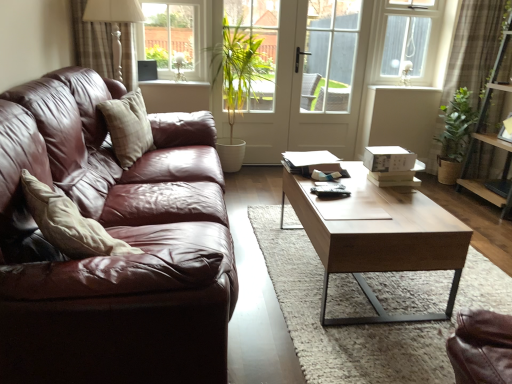
Question: Is the position of white glossy window sill at upper center, the first window sill in the right-to-left sequence, more distant than that of brown textured curtain at upper right, which is counted as the first curtain, starting from the right?

Choices:
 (A) no
 (B) yes

Answer: (B)

Question: Considering the relative sizes of white glossy window sill at upper center, which appears as the 2th window sill when viewed from the left, and brown textured curtain at upper right, which is counted as the first curtain, starting from the right, in the image provided, is white glossy window sill at upper center, which appears as the 2th window sill when viewed from the left, bigger than brown textured curtain at upper right, which is counted as the first curtain, starting from the right,?

Choices:
 (A) yes
 (B) no

Answer: (B)

Question: Considering the relative sizes of white glossy window sill at upper center, which appears as the 2th window sill when viewed from the left, and brown textured curtain at upper right, which is counted as the first curtain, starting from the right, in the image provided, is white glossy window sill at upper center, which appears as the 2th window sill when viewed from the left, thinner than brown textured curtain at upper right, which is counted as the first curtain, starting from the right,?

Choices:
 (A) no
 (B) yes

Answer: (B)

Question: Is brown textured curtain at upper right, arranged as the 2th curtain when viewed from the left, surrounded by white glossy window sill at upper center, which appears as the 1th window sill when viewed from the back?

Choices:
 (A) no
 (B) yes

Answer: (A)

Question: Can we say white glossy window sill at upper center, which appears as the 1th window sill when viewed from the back, lies outside brown textured curtain at upper right, arranged as the 2th curtain when viewed from the left?

Choices:
 (A) no
 (B) yes

Answer: (B)

Question: From their relative heights in the image, would you say white glass screen door at center is taller or shorter than white glossy window sill at upper center, acting as the second window sill starting from the front?

Choices:
 (A) short
 (B) tall

Answer: (B)

Question: In terms of width, does white glass screen door at center look wider or thinner when compared to white glossy window sill at upper center, the first window sill in the right-to-left sequence?

Choices:
 (A) thin
 (B) wide

Answer: (A)

Question: Based on their sizes in the image, would you say white glass screen door at center is bigger or smaller than white glossy window sill at upper center, acting as the second window sill starting from the front?

Choices:
 (A) small
 (B) big

Answer: (B)

Question: From the image's perspective, relative to white glossy window sill at upper center, the first window sill in the right-to-left sequence, is white glass screen door at center above or below?

Choices:
 (A) above
 (B) below

Answer: (A)

Question: Considering the relative positions of white glossy window sill at upper center, the 1th window sill positioned from the front, and leather couch at left in the image provided, is white glossy window sill at upper center, the 1th window sill positioned from the front, to the left or to the right of leather couch at left?

Choices:
 (A) left
 (B) right

Answer: (A)

Question: Looking at the image, does white glossy window sill at upper center, which is counted as the 1th window sill, starting from the left, seem bigger or smaller compared to leather couch at left?

Choices:
 (A) small
 (B) big

Answer: (A)

Question: From the image's perspective, is white glossy window sill at upper center, the 1th window sill positioned from the front, located above or below leather couch at left?

Choices:
 (A) above
 (B) below

Answer: (A)

Question: Considering their positions, is white glossy window sill at upper center, which ranks as the second window sill in right-to-left order, located in front of or behind leather couch at left?

Choices:
 (A) front
 (B) behind

Answer: (B)

Question: Considering the positions of brown textured curtain at upper right, which is counted as the first curtain, starting from the right, and clear glass window at upper left, marked as the second window in a right-to-left arrangement, in the image, is brown textured curtain at upper right, which is counted as the first curtain, starting from the right, wider or thinner than clear glass window at upper left, marked as the second window in a right-to-left arrangement,?

Choices:
 (A) thin
 (B) wide

Answer: (B)

Question: Considering their positions, is brown textured curtain at upper right, which is counted as the first curtain, starting from the right, located in front of or behind clear glass window at upper left, marked as the second window in a right-to-left arrangement?

Choices:
 (A) front
 (B) behind

Answer: (A)